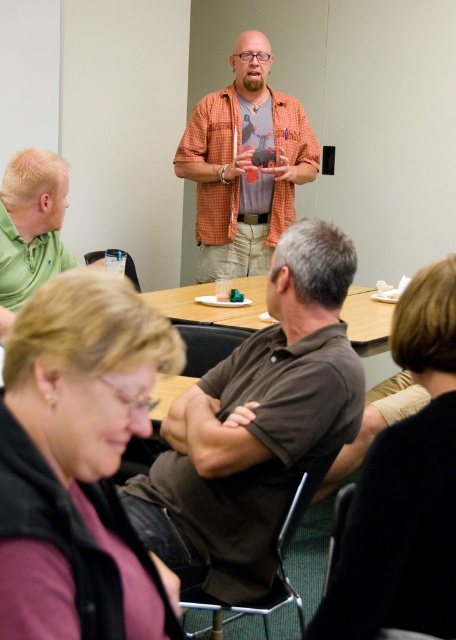
Is orange checkered shirt at center below green matte shirt at lower left?

No.

Does orange checkered shirt at center have a greater width compared to green matte shirt at lower left?

Yes.

Is point (214, 97) behind point (15, 301)?

Yes, point (214, 97) is farther from viewer.

You are a GUI agent. You are given a task and a screenshot of the screen. Output one action in this format:
    pyautogui.click(x=<x>, y=<y>)
    Task: Click on the orange checkered shirt at center
    This screenshot has width=456, height=640.
    Given the screenshot: What is the action you would take?
    pyautogui.click(x=244, y=164)

Does brown cotton shirt at center have a greater width compared to green matte shirt at lower left?

Yes.

Who is taller, brown cotton shirt at center or green matte shirt at lower left?

brown cotton shirt at center is taller.

Who is more distant from viewer, (263, 586) or (13, 227)?

Positioned behind is point (13, 227).

I want to click on brown cotton shirt at center, so click(255, 426).

Is point (236, 168) closer to viewer compared to point (363, 285)?

Yes.

The width and height of the screenshot is (456, 640). Describe the element at coordinates (244, 164) in the screenshot. I see `orange checkered shirt at center` at that location.

Identify the location of orange checkered shirt at center. Image resolution: width=456 pixels, height=640 pixels. (244, 164).